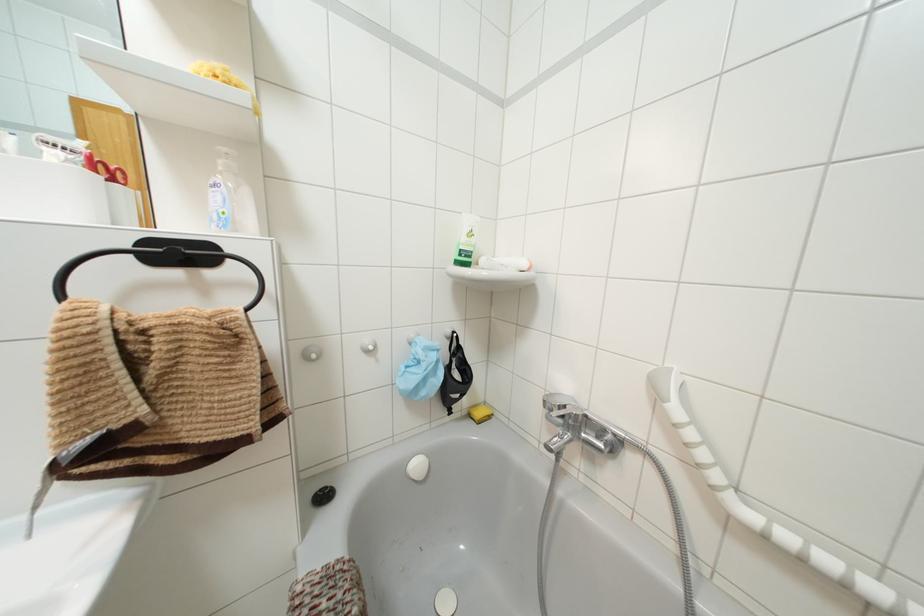
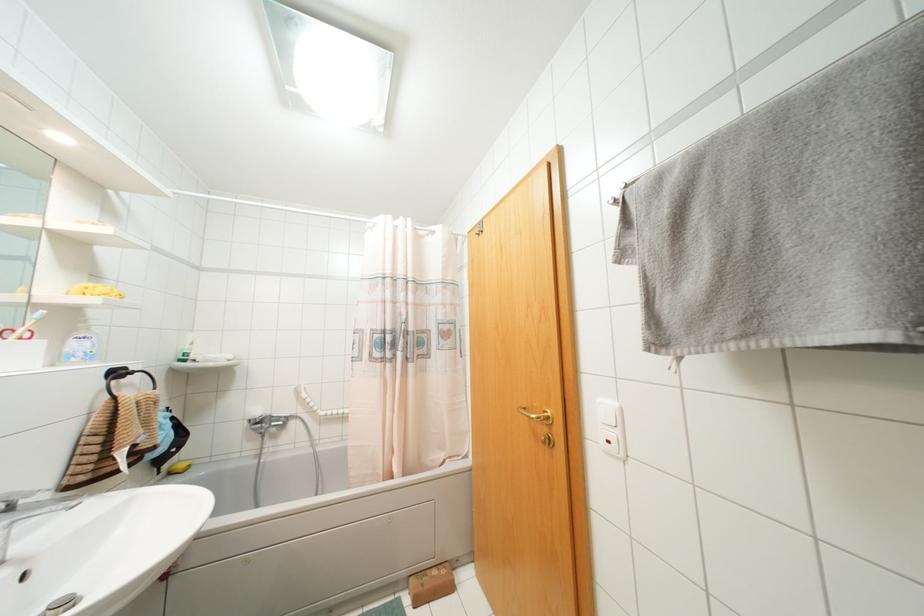
Locate, in the second image, the point that corresponds to point (566, 387) in the first image.

(258, 411)